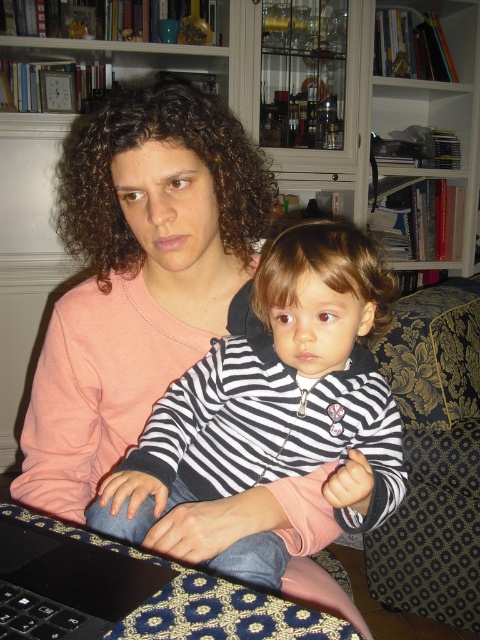
You are setting up a workspace in the living room and need to place both the black matte laptop at lower left and the black rubberized keyboard at lower left on a shelf that can only hold items up to 10 cm in height. Given their heights, will both items fit on the shelf?

The black matte laptop at lower left is taller than the black rubberized keyboard at lower left. Since the shelf can only hold items up to 10 cm in height, both items must individually be under or equal to 10 cm. However, without specific measurements, we cannot confirm if the laptop exceeds the limit. The description only states the laptop is taller than the keyboard but does not provide exact heights.

Looking at this image, you are standing in the living room and want to move from the point at coordinates [110,198] to the point at coordinates [12,595]. Which direction should you move to get closer to your destination?

To move from point [110,198] to point [12,595], you should move towards the bottom right direction since point [12,595] is located to the bottom right of point [110,198].

Looking at this image, you are organizing a space and need to move the black rubberized keyboard at lower left closer to the pink matte sweater at center. Can you move the keyboard in front of the sweater without moving the sweater?

The black rubberized keyboard at lower left is currently behind the pink matte sweater at center. To move it in front of the sweater without moving the sweater, you would need to place the keyboard in a position where it is closer to the viewer than the sweater. Since the sweater is at center and the keyboard is at lower left, adjusting its position to be in front is possible as long as there is space in front of the sweater at that location.